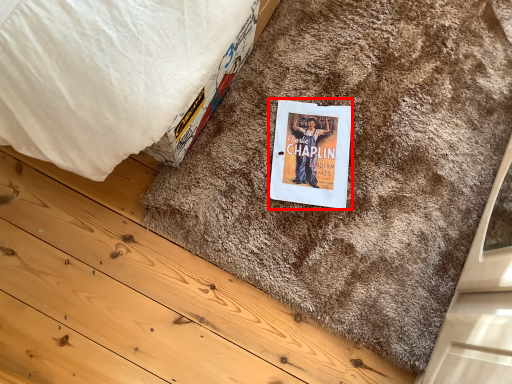
Question: From the image's perspective, what is the correct spatial positioning of paperback book (annotated by the red box) in reference to doormat?

Choices:
 (A) above
 (B) below

Answer: (B)